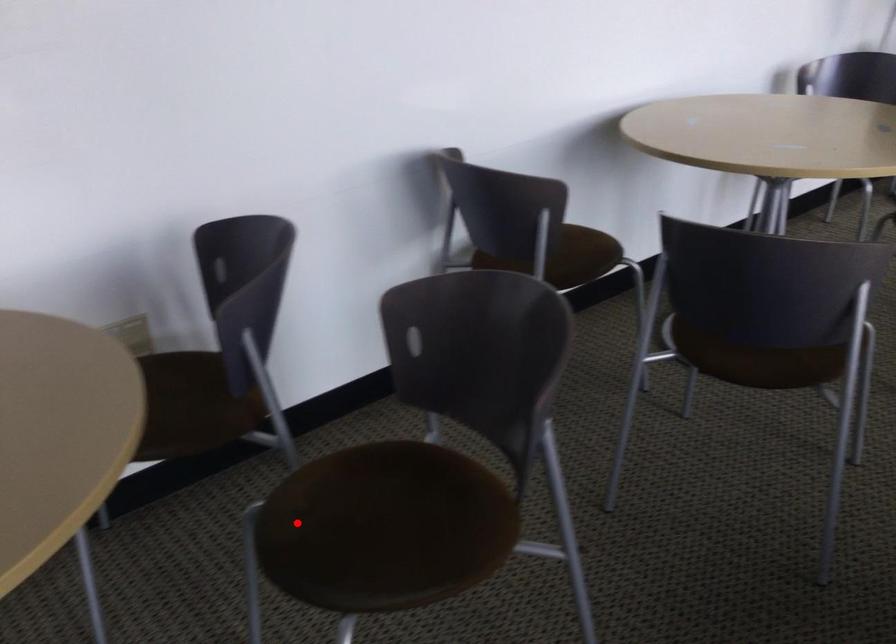
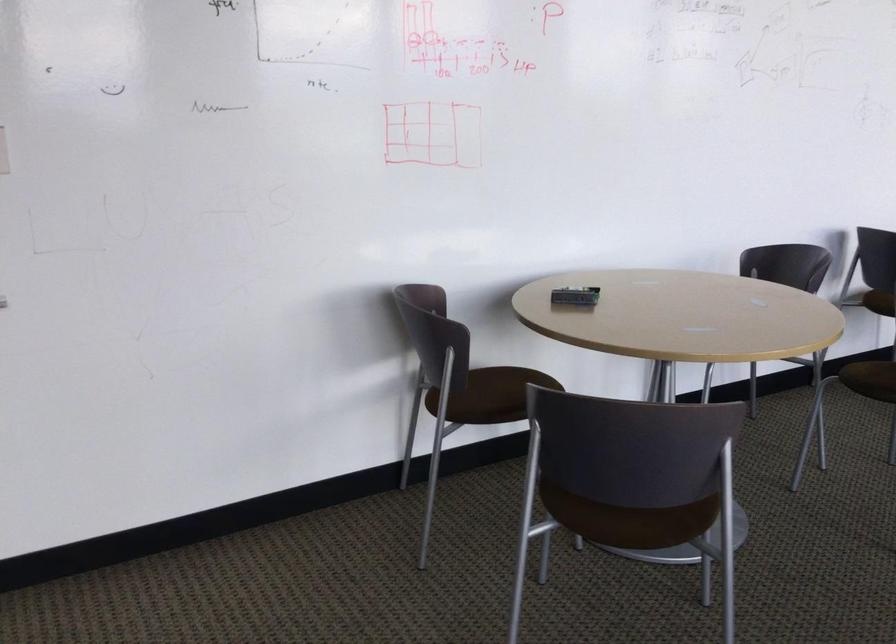
Question: I am providing you with two images of the same scene from different viewpoints. Given a red point in image1, look at the same physical point in image2. Is it:

Choices:
 (A) Closer to the viewpoint
 (B) Farther from the viewpoint

Answer: (B)